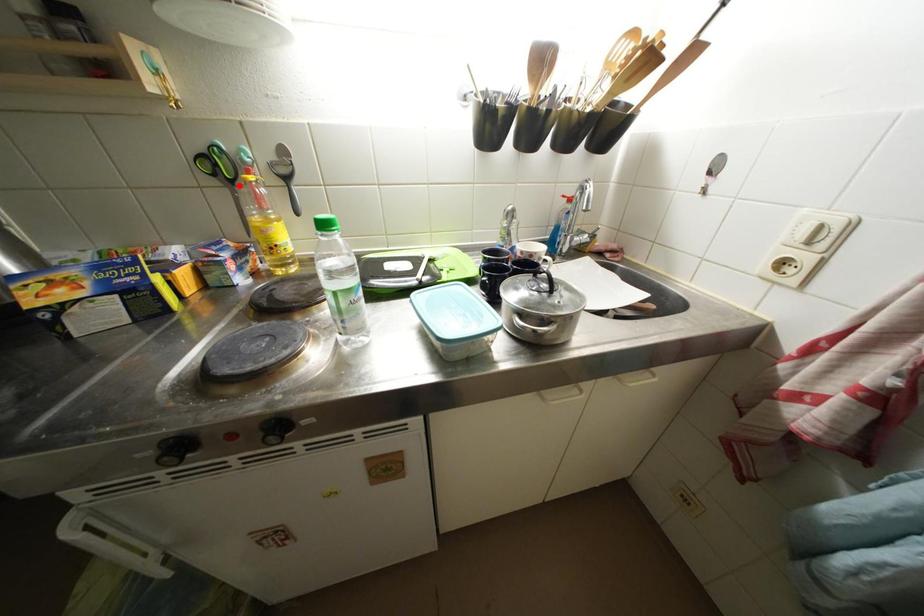
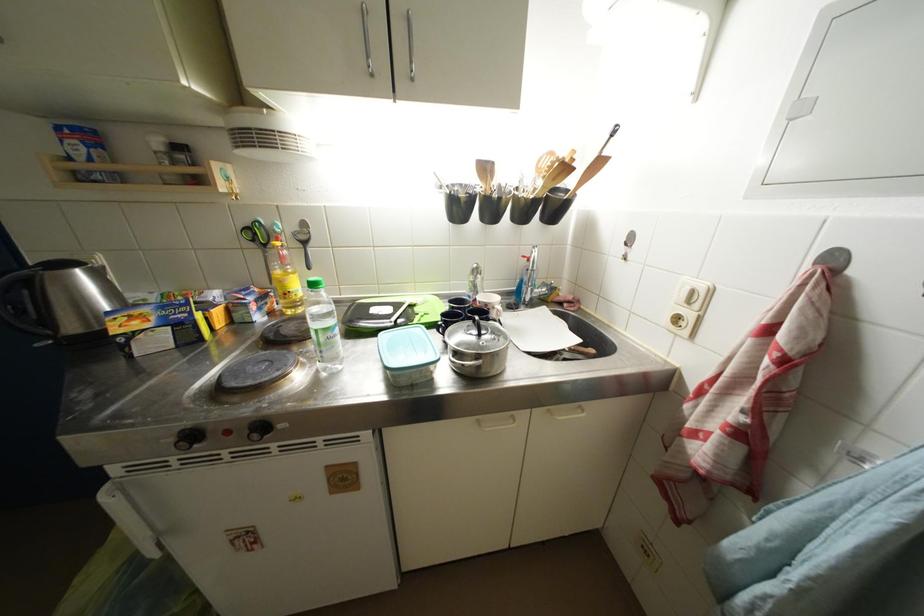
The point at the highlighted location is marked in the first image. Where is the corresponding point in the second image?

(272, 249)